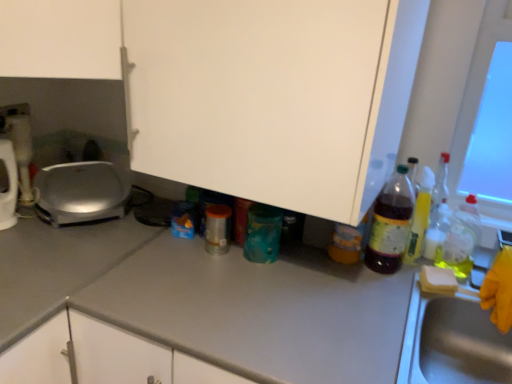
This screenshot has height=384, width=512. Identify the location of vacant region to the left of translucent plastic bottle at right, the 2th bottle in the right-to-left sequence. (341, 268).